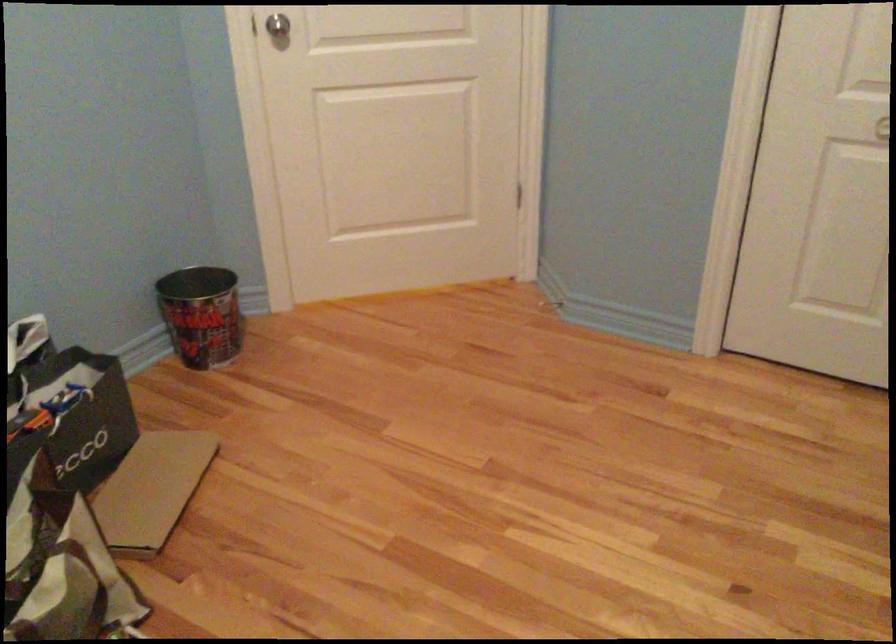
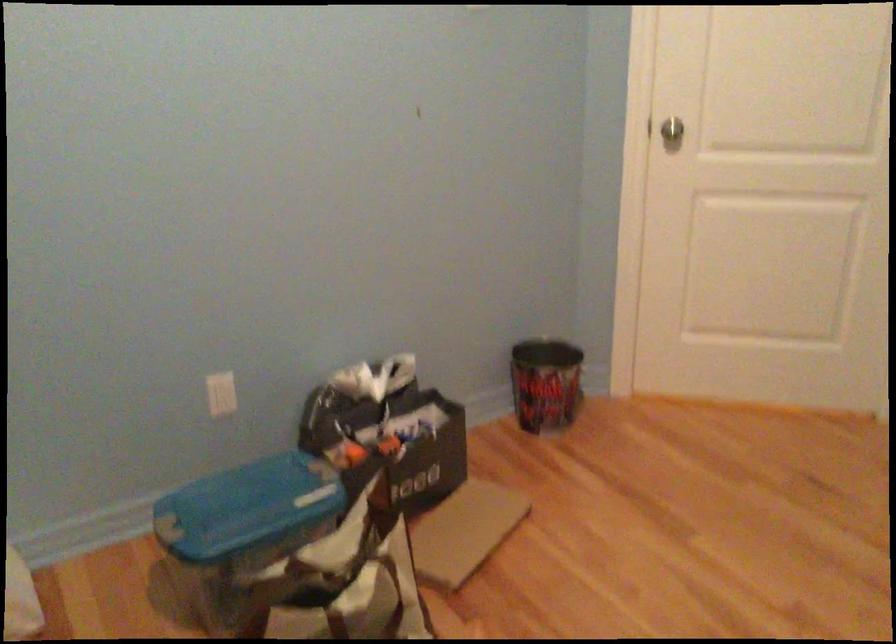
The point at [204,314] is marked in the first image. Where is the corresponding point in the second image?

(545, 383)